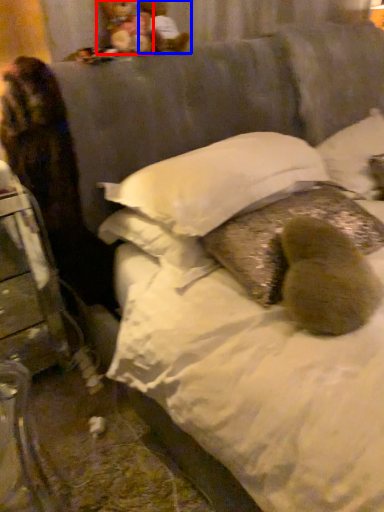
Question: Which of the following is the closest to the observer, figurine (highlighted by a red box) or figurine (highlighted by a blue box)?

Choices:
 (A) figurine
 (B) figurine

Answer: (A)